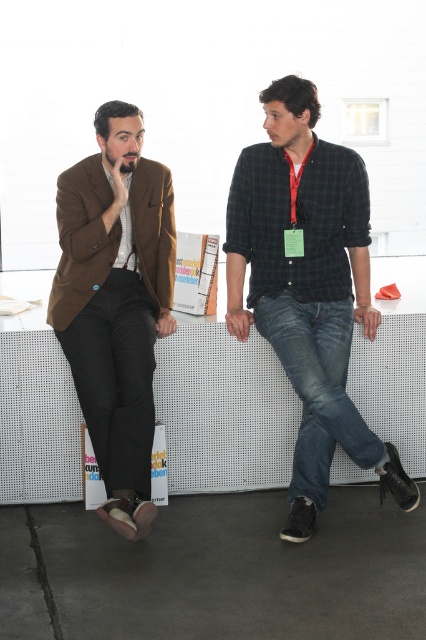
You are designing a new clothing line and want to create a matching set using the green plaid shirt at center and denim jeans at center. Based on their sizes, which one should be the base piece to ensure proper proportion?

The green plaid shirt at center is larger in size than denim jeans at center, so it should be the base piece to ensure proper proportion.

You are standing in front of the bench and want to place a small object on the nearest point between point (259, 189) and point (317, 476). Which point should you choose?

Point (317, 476) is closer to you because it is less further to the camera than point (259, 189).

What are the coordinates of the green plaid shirt at center?

The green plaid shirt at center is located at coordinates point (x=307, y=289).